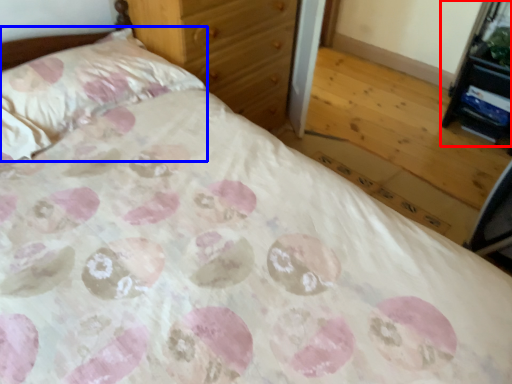
Question: Which object appears farthest to the camera in this image, vanity (highlighted by a red box) or pillow (highlighted by a blue box)?

Choices:
 (A) vanity
 (B) pillow

Answer: (A)